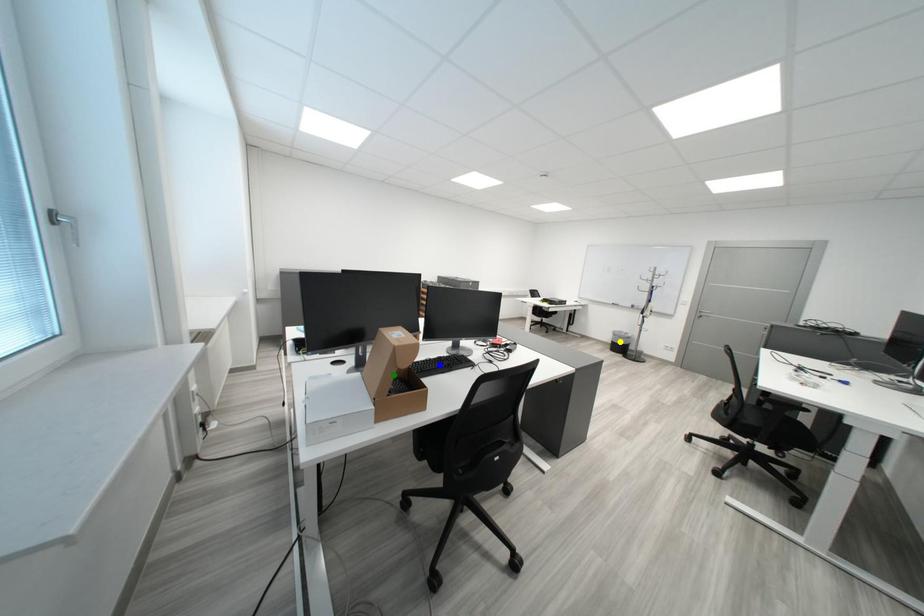
Order these from nearest to farthest:
1. green point
2. yellow point
3. blue point

green point
blue point
yellow point